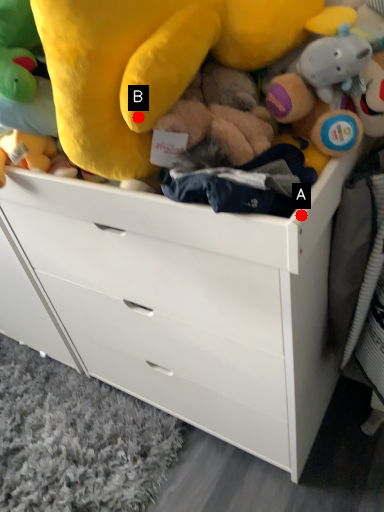
Question: Two points are circled on the image, labeled by A and B beside each circle. Which point is farther from the camera taking this photo?

Choices:
 (A) A is further
 (B) B is further

Answer: (B)